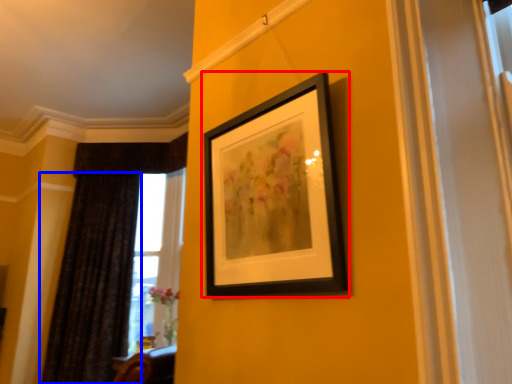
Question: Which of the following is the closest to the observer, picture frame (highlighted by a red box) or curtain (highlighted by a blue box)?

Choices:
 (A) picture frame
 (B) curtain

Answer: (A)